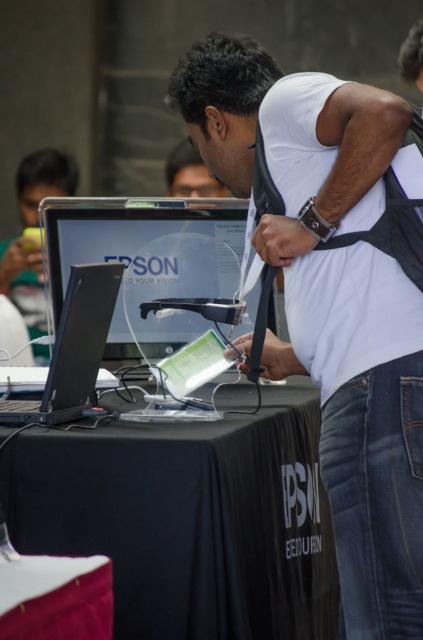
Question: Which of the following is the farthest from the observer?

Choices:
 (A) (49, 394)
 (B) (197, 180)
 (C) (107, 470)
 (D) (24, 262)

Answer: (B)

Question: Does satin black monitor at center appear over matte black laptop at left?

Choices:
 (A) no
 (B) yes

Answer: (A)

Question: Can you confirm if black matte laptop at center is positioned above matte black laptop at left?

Choices:
 (A) yes
 (B) no

Answer: (B)

Question: Among these points, which one is farthest from the camera?

Choices:
 (A) (43, 352)
 (B) (191, 320)
 (C) (76, 385)

Answer: (A)

Question: Does matte black laptop at left have a lesser width compared to white matte shirt at upper center?

Choices:
 (A) no
 (B) yes

Answer: (A)

Question: Which object is the closest to the white matte shirt at upper center?

Choices:
 (A) black fabric table at center
 (B) black fabric table at lower center
 (C) satin black monitor at center
 (D) matte black laptop at left

Answer: (D)